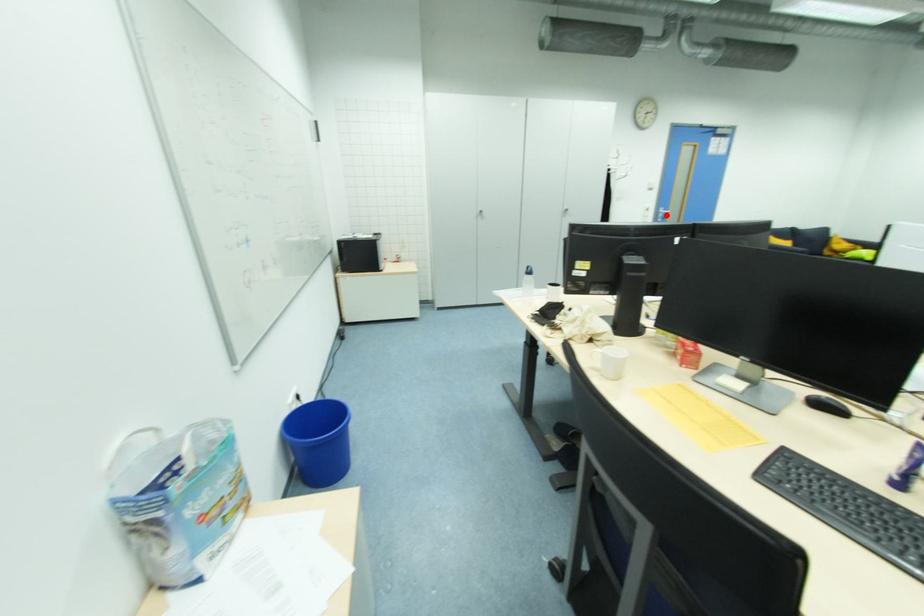
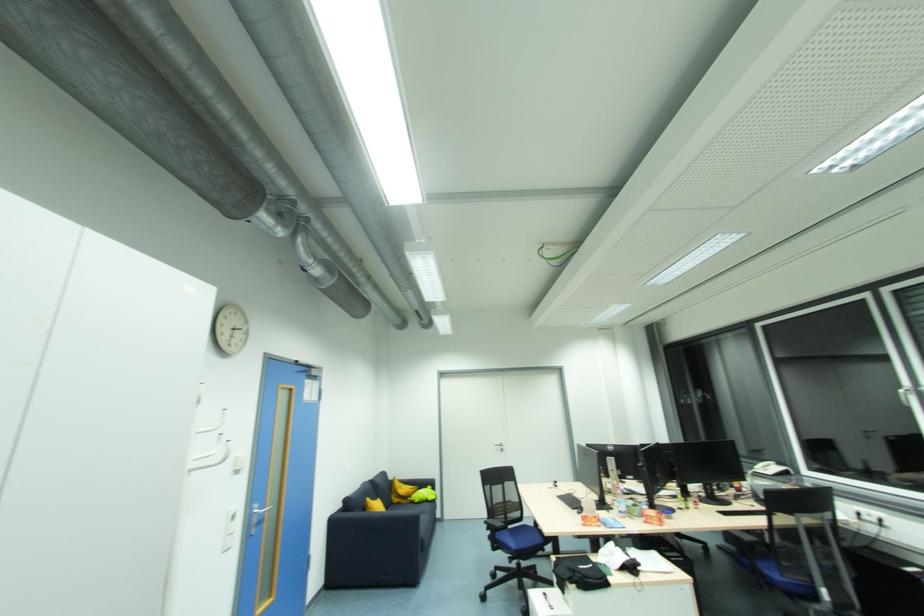
The point at the highlighted location is marked in the first image. Where is the corresponding point in the second image?

(261, 517)